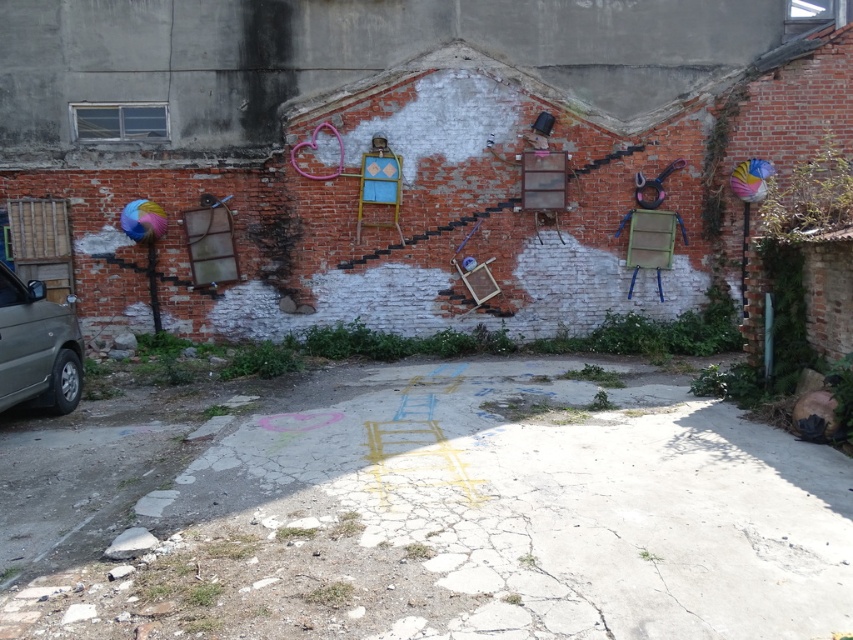
Looking at this image, you are standing at the entrance of an alley and see the cracked concrete ground at center marked by point (426,512). If you walk straight ahead, will you step onto the cracked concrete ground at center?

Yes, because the cracked concrete ground at center is located at point (426,512), which is directly ahead in the center of the scene.

You are a delivery person standing at the silver metallic car at left. You need to deliver a package to the cracked concrete ground at center. Can you walk directly to the destination without any obstacles?

The cracked concrete ground at center and silver metallic car at left are 6.25 meters apart, so yes, you can walk directly to the destination without any obstacles since there is enough space between them.

You are standing in front of the urban scene described. You see the cracked concrete ground at center and the silver metallic car at left. Which object is positioned lower in the image?

The cracked concrete ground at center is located below the silver metallic car at left, so it is positioned lower in the image.